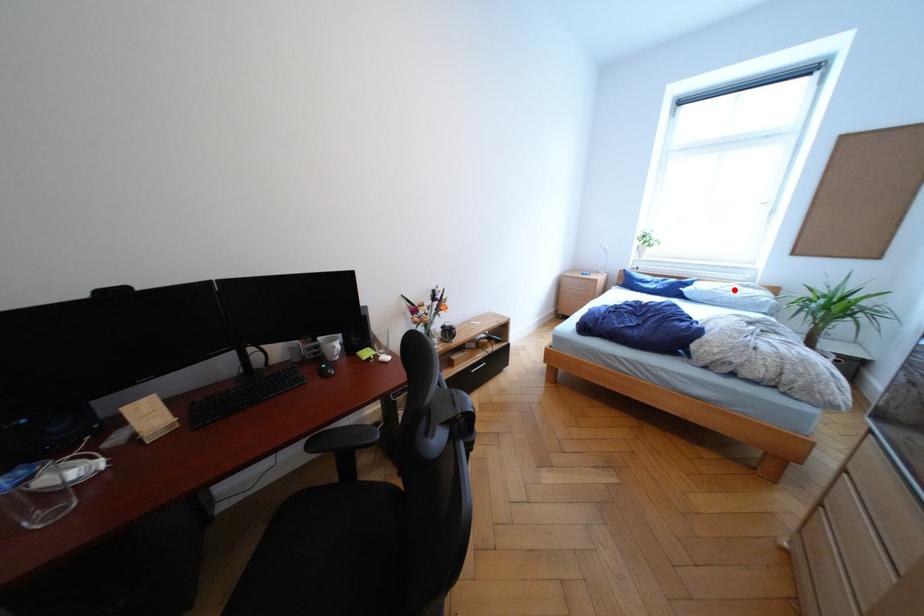
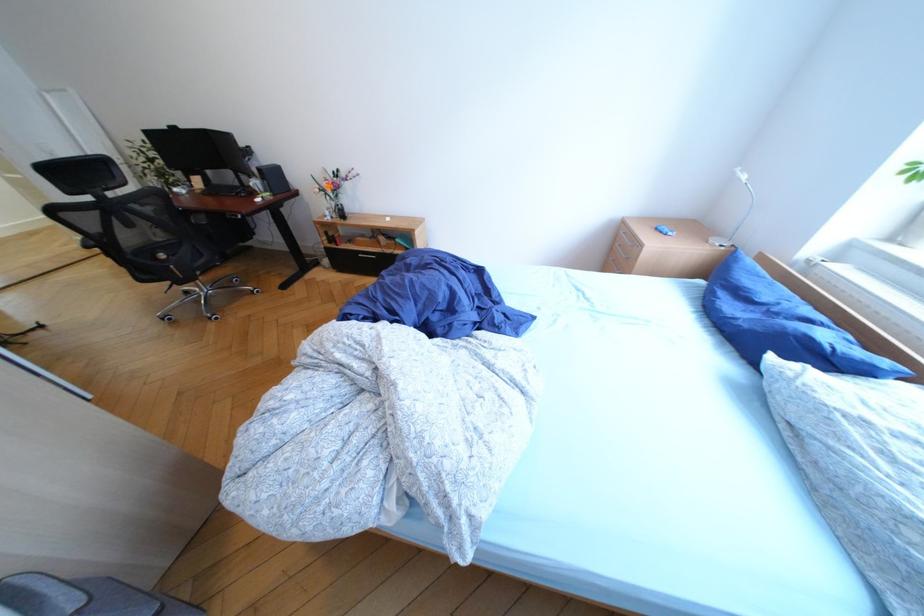
Question: I am providing you with two images of the same scene from different viewpoints. A red point is shown in image1. For the corresponding object point in image2, is it positioned nearer or farther from the camera?

Choices:
 (A) Nearer
 (B) Farther

Answer: (B)